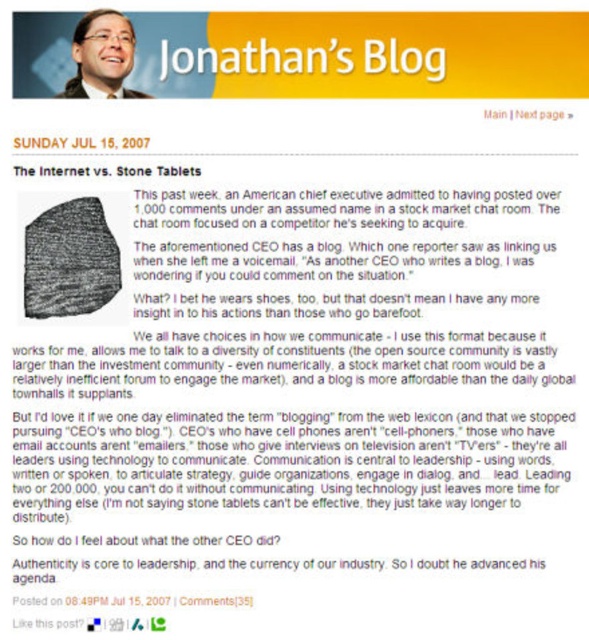
Question: Is white paper at upper center wider than black paper at upper left?

Choices:
 (A) no
 (B) yes

Answer: (B)

Question: Which point appears closest to the camera in this image?

Choices:
 (A) (130, 26)
 (B) (289, 58)
 (C) (495, 115)

Answer: (C)

Question: Which object is closer to the camera taking this photo?

Choices:
 (A) black stone tablet at upper left
 (B) black paper at upper left

Answer: (A)

Question: Among these points, which one is farthest from the camera?

Choices:
 (A) (14, 138)
 (B) (49, 166)

Answer: (B)

Question: Is white paper at upper center positioned at the back of black stone tablet at upper left?

Choices:
 (A) yes
 (B) no

Answer: (A)

Question: Is matte black glasses at upper left further to camera compared to black paper at upper left?

Choices:
 (A) no
 (B) yes

Answer: (B)